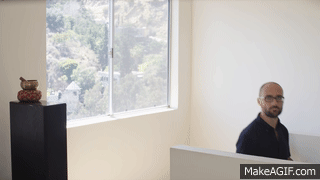
Image resolution: width=320 pixels, height=180 pixels. Find the location of `bowl`. bowl is located at coordinates (28, 83).